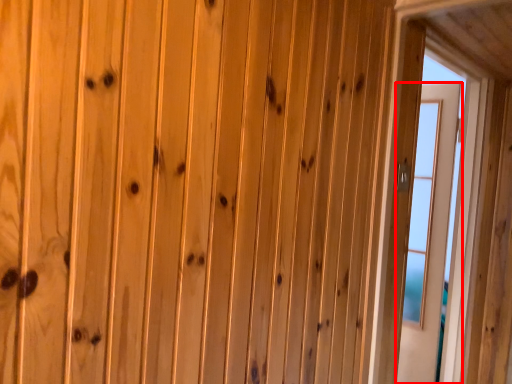
Question: Where is door (annotated by the red box) located in relation to window in the image?

Choices:
 (A) left
 (B) right

Answer: (B)